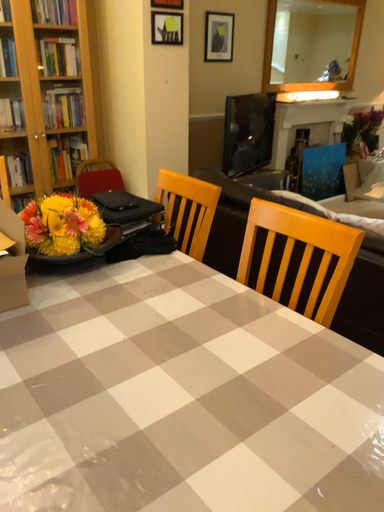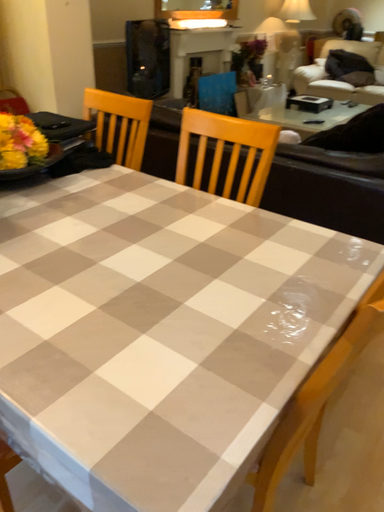
Question: Which way did the camera rotate in the video?

Choices:
 (A) rotated downward
 (B) rotated upward

Answer: (A)